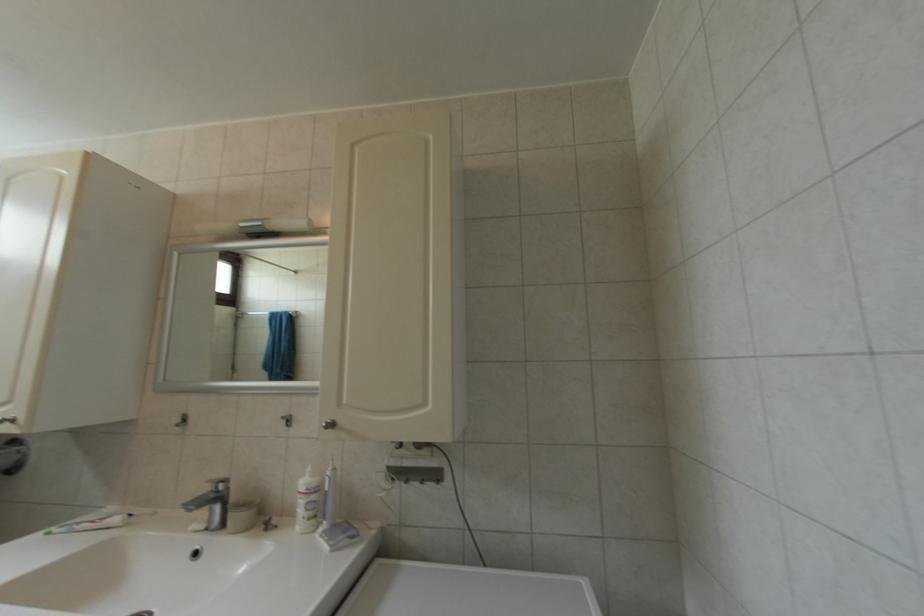
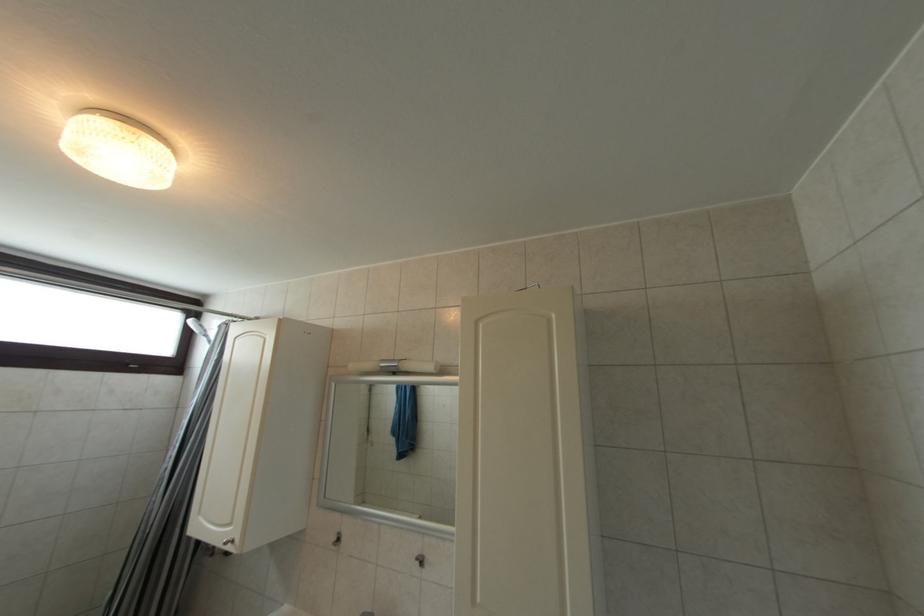
Question: Based on the continuous images, in which direction is the camera rotating? Reply with the corresponding letter.

Choices:
 (A) Left
 (B) Right
 (C) Up
 (D) Down

Answer: (A)